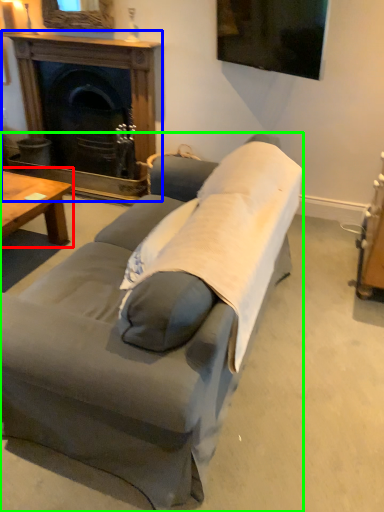
Question: Estimate the real-world distances between objects in this image. Which object is closer to coffee table (highlighted by a red box), fireplace (highlighted by a blue box) or studio couch (highlighted by a green box)?

Choices:
 (A) fireplace
 (B) studio couch

Answer: (A)